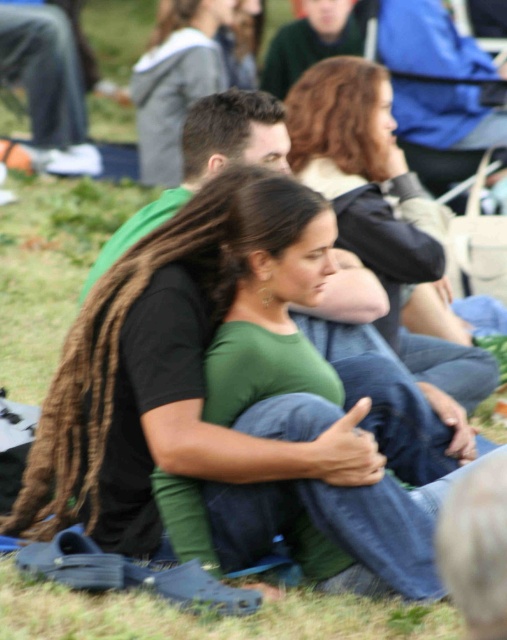
You are a photographer trying to capture a closeup of the green matte shirt at upper center and the green grass at lower center. Which object will appear bigger in your photo?

The green matte shirt at upper center will appear bigger in the photo because it is larger in size than the green grass at lower center.

You are a photographer trying to capture a closeup of the green matte shirt at upper center and the black matte shirt at center. Which shirt should you focus on first to ensure both are in focus without moving the camera?

The green matte shirt at upper center is closer to the viewer than the black matte shirt at center, so focusing on the green matte shirt at upper center first will keep both in focus since it is nearer.

You are standing at a distance of 5 meters from the point marked at coordinates point [389,131]. Can you confirm if you are closer to or farther away from that point compared to the people in the foreground?

The distance of point [389,131] from viewer is 5.12 meters. Since you are standing at 5 meters, you are closer to the point than the people in the foreground who are presumably closer to the viewer than the point.